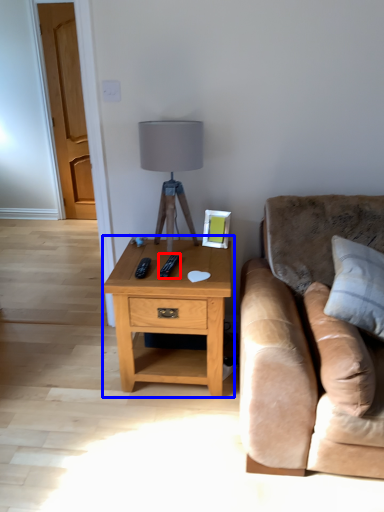
Question: Which object is closer to the camera taking this photo, remote (highlighted by a red box) or nightstand (highlighted by a blue box)?

Choices:
 (A) remote
 (B) nightstand

Answer: (B)